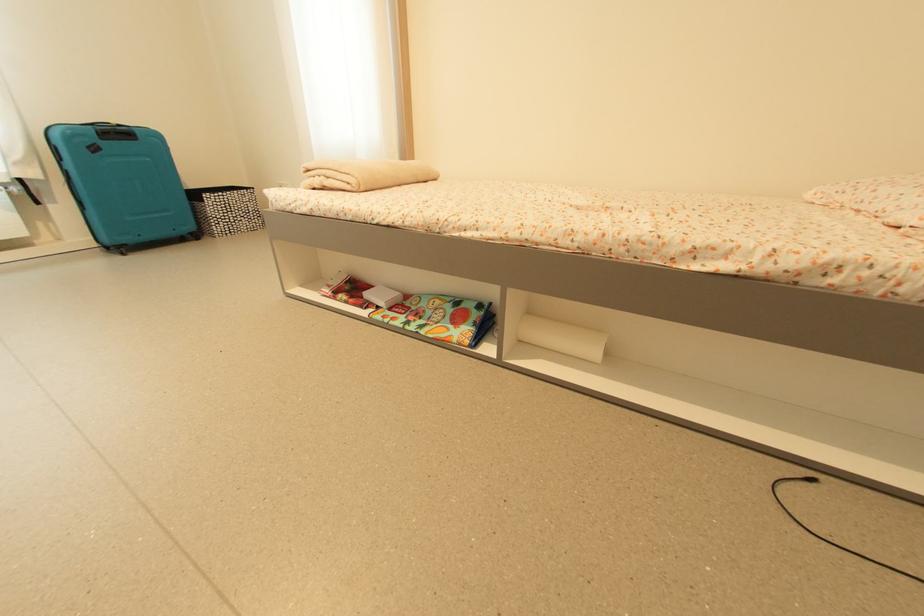
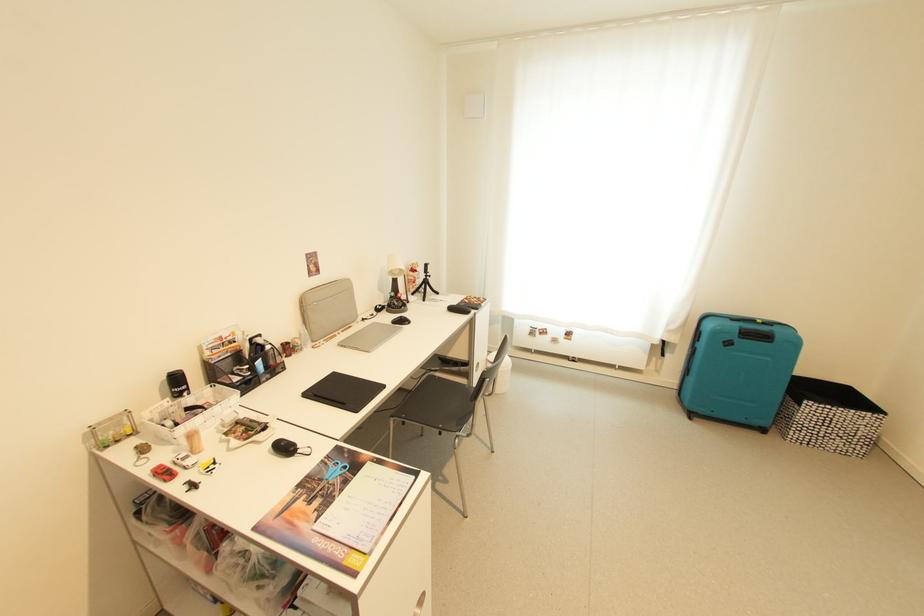
Question: The first image is from the beginning of the video and the second image is from the end. How did the camera likely rotate when shooting the video?

Choices:
 (A) Left
 (B) Right
 (C) Up
 (D) Down

Answer: (A)